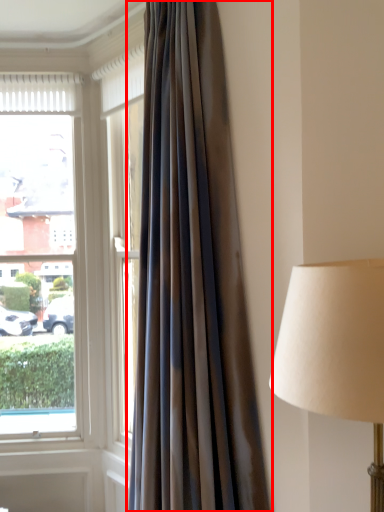
Question: Observing the image, what is the correct spatial positioning of curtain (annotated by the red box) in reference to window?

Choices:
 (A) left
 (B) right

Answer: (B)